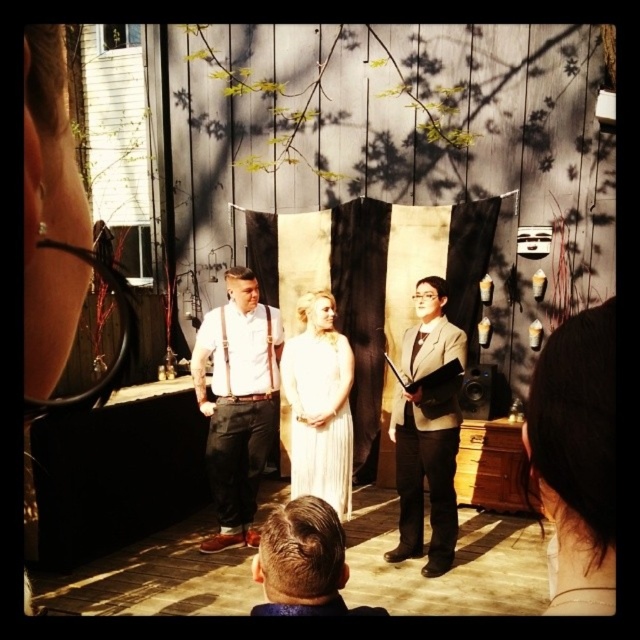
Does matte white shirt at center appear on the left side of brown hair at center?

Correct, you'll find matte white shirt at center to the left of brown hair at center.

Which is behind, point (205, 394) or point (284, 609)?

The point (205, 394) is more distant.

Locate an element on the screen. matte white shirt at center is located at coordinates (237, 403).

Does satin beige blazer at center appear over white satin dress at center?

Correct, satin beige blazer at center is located above white satin dress at center.

Is point (433, 282) positioned before point (321, 353)?

Yes, it is in front of point (321, 353).

Locate an element on the screen. satin beige blazer at center is located at coordinates (426, 472).

I want to click on satin beige blazer at center, so click(426, 472).

Is white satin dress at center shorter than brown hair at center?

No.

Is point (307, 388) closer to camera compared to point (310, 522)?

No, (307, 388) is behind (310, 522).

Find the location of a particular element. white satin dress at center is located at coordinates (320, 417).